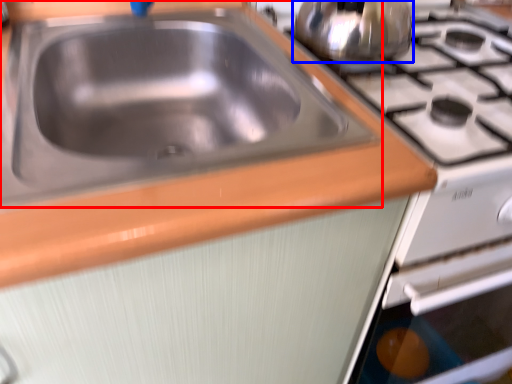
Question: Which point is further to the camera, sink (highlighted by a red box) or tea pot (highlighted by a blue box)?

Choices:
 (A) sink
 (B) tea pot

Answer: (B)